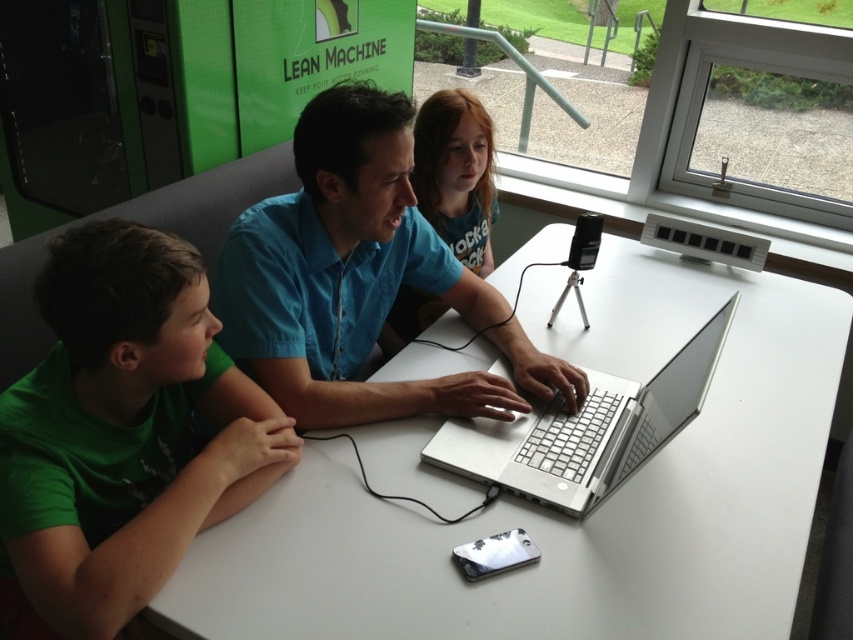
You are a photographer trying to capture a clear shot of the blue matte shirt at center and the silver metallic laptop at center. Since you want both subjects to be in focus, which one should you adjust your camera focus on first to ensure the other is also in focus?

The blue matte shirt at center is larger in size than the silver metallic laptop at center, so you should focus on the blue matte shirt at center first to ensure the silver metallic laptop at center is also in focus.

You are a photographer positioned at the center of the room. You need to take a photo of the blue matte shirt at center. Where should you aim your camera?

A: The blue matte shirt at center is located at point 0.422, so aim your camera at that coordinate.

You are a photographer positioned behind the table and want to capture a clear shot of the silver metallic laptop at center without the blue matte shirt at center blocking it. How should you adjust your position?

The silver metallic laptop at center is behind the blue matte shirt at center, so to avoid blocking, you should move to the side of the table where the blue matte shirt at center is not obstructing the view.